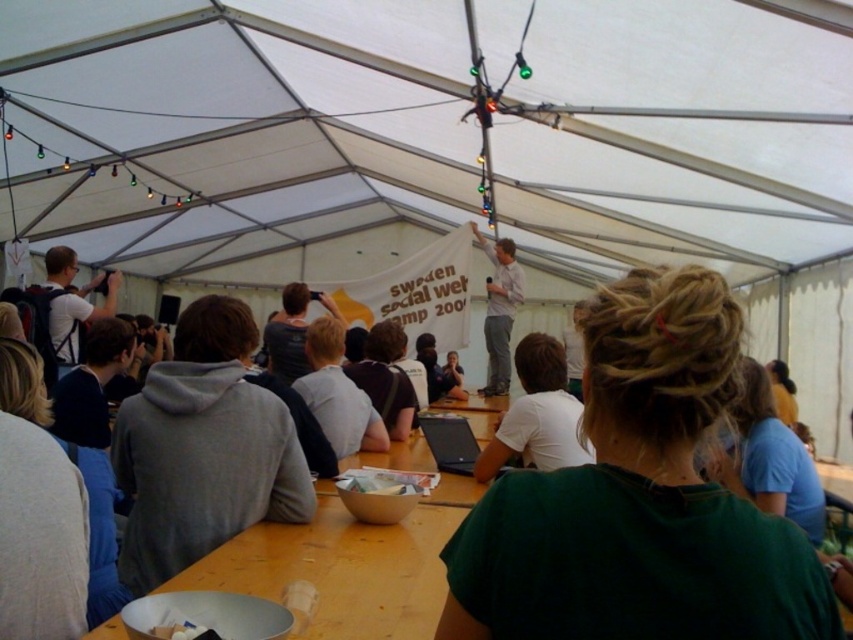
Question: Which point appears closest to the camera in this image?

Choices:
 (A) (231, 496)
 (B) (77, 292)
 (C) (572, 452)

Answer: (A)

Question: Is gray hoodie at center smaller than blue cotton shirt at upper right?

Choices:
 (A) yes
 (B) no

Answer: (B)

Question: Observing the image, what is the correct spatial positioning of green fabric hair at center in reference to blue cotton shirt at upper right?

Choices:
 (A) right
 (B) left

Answer: (B)

Question: Among these objects, which one is farthest from the camera?

Choices:
 (A) blue cotton shirt at upper right
 (B) gray hoodie at center
 (C) matte white shirt at left

Answer: (C)

Question: Which point is closer to the camera?

Choices:
 (A) gray hoodie at center
 (B) green fabric hair at center
 (C) white matte laptop at center
 (D) light gray shirt at upper center

Answer: (B)

Question: Does green fabric hair at center lie in front of matte white shirt at left?

Choices:
 (A) no
 (B) yes

Answer: (B)